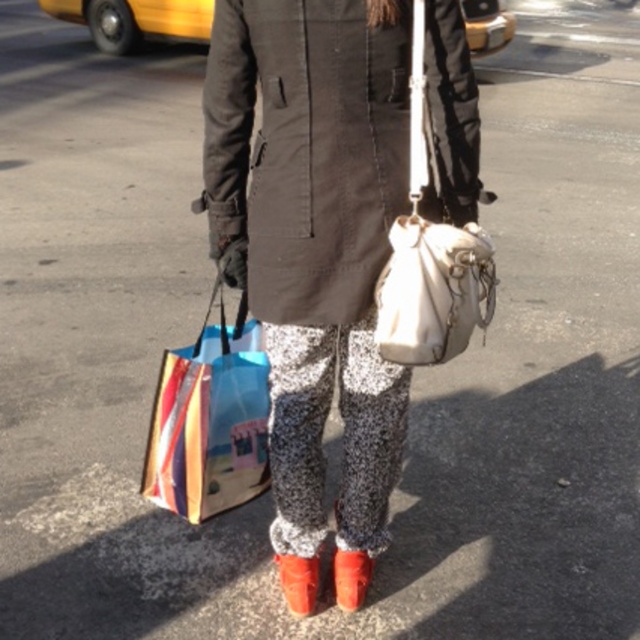
Between speckled fabric pants at center and leather/soft white purse at center, which one is positioned lower?

speckled fabric pants at center is below.

Which is more to the right, speckled fabric pants at center or leather/soft white purse at center?

leather/soft white purse at center

Who is more forward, (308, 440) or (486, 300)?

Point (486, 300)

Locate an element on the screen. Image resolution: width=640 pixels, height=640 pixels. speckled fabric pants at center is located at coordinates (342, 433).

Measure the distance between point (381, 148) and camera.

A distance of 1.78 meters exists between point (381, 148) and camera.

Who is positioned more to the right, matte black coat at center or shiny red high-heeled shoe at lower center?

From the viewer's perspective, matte black coat at center appears more on the right side.

Which is in front, point (308, 512) or point (312, 589)?

Point (308, 512) is more forward.

Where is `matte black coat at center`? The image size is (640, 640). matte black coat at center is located at coordinates (314, 237).

How distant is colorful paper bag at lower left from yellow rubber taxi at upper left?

colorful paper bag at lower left and yellow rubber taxi at upper left are 7.31 meters apart from each other.

In the scene shown: Can you confirm if colorful paper bag at lower left is wider than yellow rubber taxi at upper left?

Incorrect, colorful paper bag at lower left's width does not surpass yellow rubber taxi at upper left's.

Measure the distance between colorful paper bag at lower left and camera.

The distance of colorful paper bag at lower left from camera is 6.44 feet.

Identify the location of colorful paper bag at lower left. (209, 420).